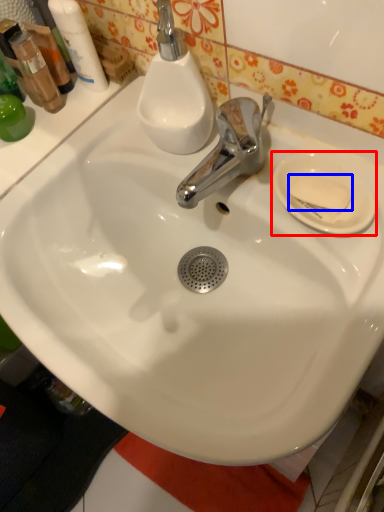
Question: Which point is further to the camera, plate (highlighted by a red box) or soap (highlighted by a blue box)?

Choices:
 (A) plate
 (B) soap

Answer: (B)